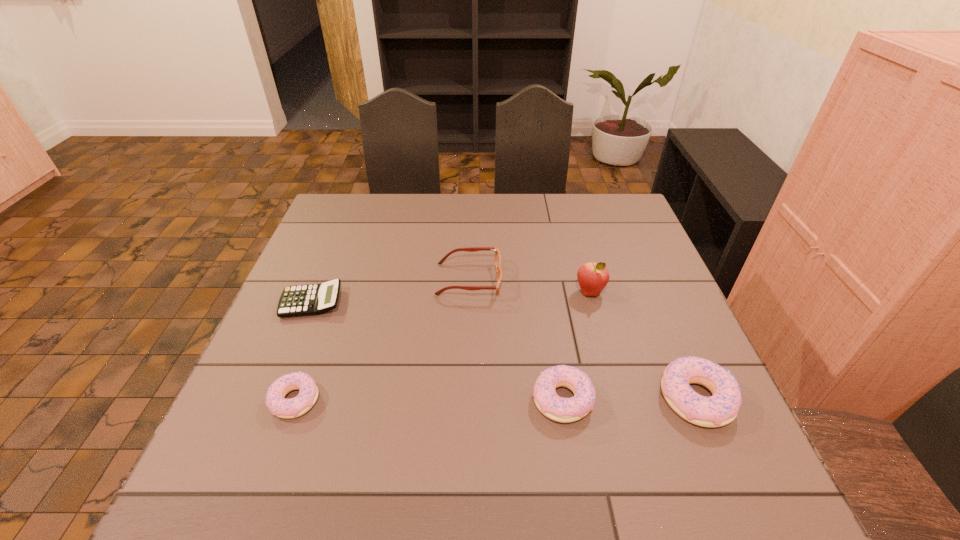
Image resolution: width=960 pixels, height=540 pixels. What are the coordinates of `vacant space located on the right of the shortest doughnut` in the screenshot? It's located at (450, 400).

Identify the location of vacant space located on the left of the second doughnut from right to left. (449, 399).

The image size is (960, 540). I want to click on vacant region located on the back of the tallest doughnut, so click(x=671, y=340).

Identify the location of free space located on the front of the calculator. Image resolution: width=960 pixels, height=540 pixels. click(x=290, y=355).

You are a GUI agent. You are given a task and a screenshot of the screen. Output one action in this format:
    pyautogui.click(x=<x>, y=<y>)
    Task: Click on the vacant space located on the front-facing side of the fourth object from right to left
    The height and width of the screenshot is (540, 960).
    Given the screenshot: What is the action you would take?
    pyautogui.click(x=571, y=279)

Find the location of `blank area located 0.110m on the back of the second object from right to left`. blank area located 0.110m on the back of the second object from right to left is located at coordinates (580, 256).

This screenshot has height=540, width=960. Find the location of `doughnut located at the left edge`. doughnut located at the left edge is located at coordinates (275, 400).

Image resolution: width=960 pixels, height=540 pixels. In order to click on calculator that is at the left edge in this screenshot , I will do `click(312, 299)`.

This screenshot has width=960, height=540. Identify the location of object at the right edge. (722, 408).

Where is `object present at the near left corner`? The image size is (960, 540). object present at the near left corner is located at coordinates (275, 400).